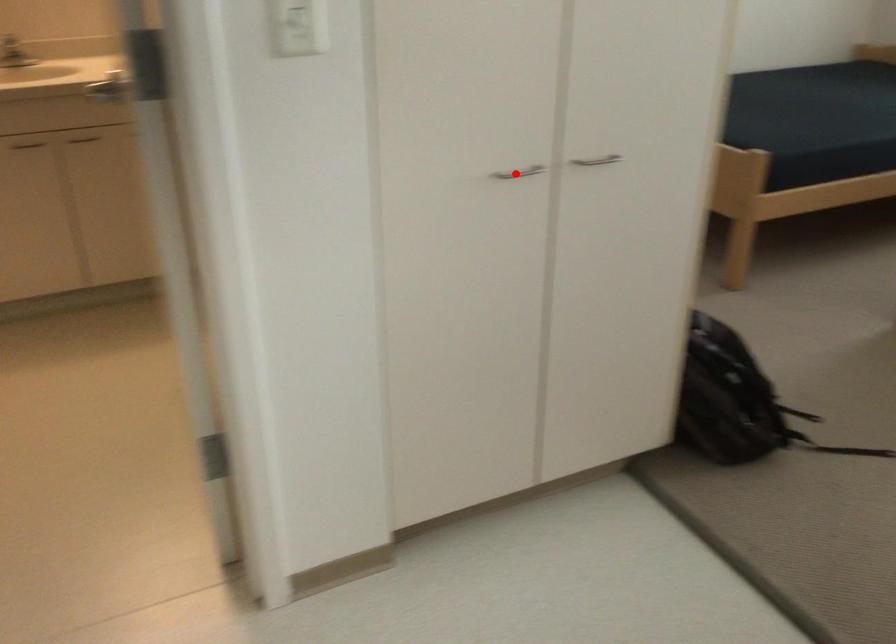
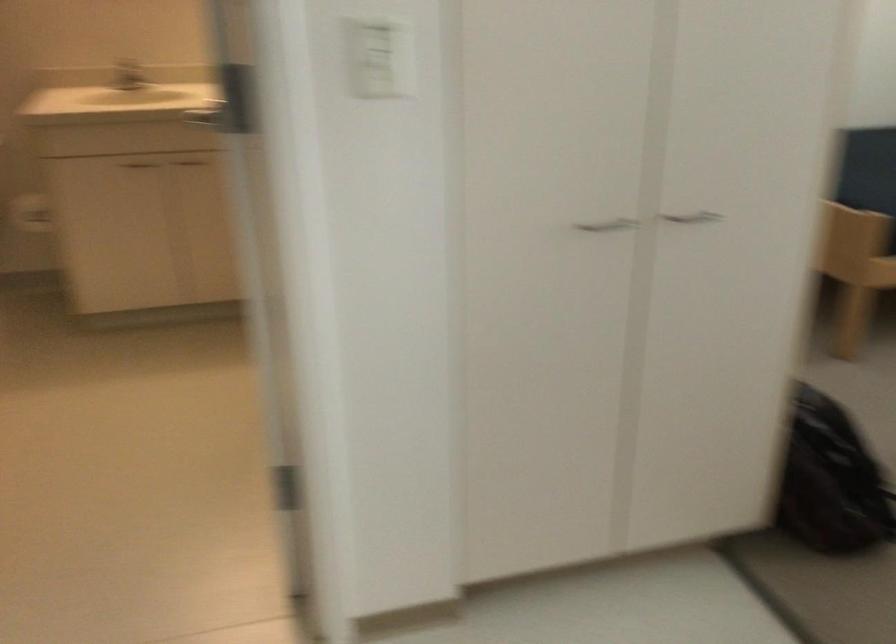
Where in the second image is the point corresponding to the highlighted location from the first image?

(607, 225)